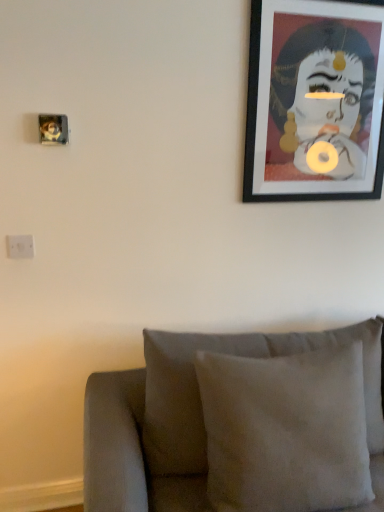
The width and height of the screenshot is (384, 512). In order to click on suede cushion at lower center in this screenshot , I will do `click(239, 424)`.

I want to click on black matte picture frame at upper right, so click(315, 101).

Is white plastic electric outlet at left positioned behind suede cushion at lower center?

Yes, white plastic electric outlet at left is further from the camera.

Considering the relative sizes of white plastic electric outlet at left and suede cushion at lower center in the image provided, is white plastic electric outlet at left smaller than suede cushion at lower center?

Yes, white plastic electric outlet at left is smaller than suede cushion at lower center.

Measure the distance from white plastic electric outlet at left to suede cushion at lower center.

A distance of 37.07 inches exists between white plastic electric outlet at left and suede cushion at lower center.

Is the surface of white plastic electric outlet at left in direct contact with suede cushion at lower center?

There is a gap between white plastic electric outlet at left and suede cushion at lower center.

Between point (247, 484) and point (373, 60), which one is positioned in front?

Point (247, 484)

In the scene shown: Considering the relative positions of suede cushion at lower center and black matte picture frame at upper right in the image provided, is suede cushion at lower center to the left or to the right of black matte picture frame at upper right?

Clearly, suede cushion at lower center is on the left of black matte picture frame at upper right in the image.

Does suede cushion at lower center have a greater height compared to black matte picture frame at upper right?

Yes, suede cushion at lower center is taller than black matte picture frame at upper right.

Would you consider black matte picture frame at upper right to be distant from suede cushion at lower center?

No, black matte picture frame at upper right is in close proximity to suede cushion at lower center.

Looking at their sizes, would you say black matte picture frame at upper right is wider or thinner than suede cushion at lower center?

Clearly, black matte picture frame at upper right has less width compared to suede cushion at lower center.

Considering the positions of points (351, 136) and (333, 348), is point (351, 136) farther from camera compared to point (333, 348)?

Yes, point (351, 136) is behind point (333, 348).

From a real-world perspective, is black matte picture frame at upper right over suede cushion at lower center?

Yes, from a real-world perspective, black matte picture frame at upper right is on top of suede cushion at lower center.

From the image's perspective, which is above, black matte picture frame at upper right or white plastic electric outlet at left?

black matte picture frame at upper right appears higher in the image.

From the picture: From a real-world perspective, is black matte picture frame at upper right positioned over white plastic electric outlet at left based on gravity?

Yes, from a real-world perspective, black matte picture frame at upper right is over white plastic electric outlet at left

Are black matte picture frame at upper right and white plastic electric outlet at left making contact?

black matte picture frame at upper right and white plastic electric outlet at left are clearly separated.

Considering their positions, is black matte picture frame at upper right located in front of or behind white plastic electric outlet at left?

black matte picture frame at upper right is in front of white plastic electric outlet at left.

Locate an element on the screen. This screenshot has width=384, height=512. furniture that appears below the white plastic electric outlet at left (from a real-world perspective) is located at coordinates (239, 424).

Which point is more forward, (x=89, y=437) or (x=29, y=243)?

The point (x=89, y=437) is closer.

Which object is positioned more to the right, suede cushion at lower center or white plastic electric outlet at left?

suede cushion at lower center is more to the right.

Is suede cushion at lower center oriented away from white plastic electric outlet at left?

suede cushion at lower center does not have its back to white plastic electric outlet at left.

From the image's perspective, does white plastic electric outlet at left appear higher than black matte picture frame at upper right?

No, from the image's perspective, white plastic electric outlet at left is not over black matte picture frame at upper right.

Is white plastic electric outlet at left looking in the opposite direction of black matte picture frame at upper right?

No, white plastic electric outlet at left's orientation is not away from black matte picture frame at upper right.

Considering the sizes of objects white plastic electric outlet at left and black matte picture frame at upper right in the image provided, who is smaller, white plastic electric outlet at left or black matte picture frame at upper right?

Smaller between the two is white plastic electric outlet at left.

Where is `furniture to the right of white plastic electric outlet at left`? This screenshot has height=512, width=384. furniture to the right of white plastic electric outlet at left is located at coordinates pos(239,424).

Image resolution: width=384 pixels, height=512 pixels. I want to click on picture frame that is behind the suede cushion at lower center, so click(315, 101).

From the picture: From the image, which object appears to be farther from white plastic electric outlet at left, suede cushion at lower center or black matte picture frame at upper right?

Based on the image, black matte picture frame at upper right appears to be further to white plastic electric outlet at left.

From the picture: Estimate the real-world distances between objects in this image. Which object is closer to black matte picture frame at upper right, suede cushion at lower center or white plastic electric outlet at left?

suede cushion at lower center lies closer to black matte picture frame at upper right than the other object.

Which object lies nearer to the anchor point white plastic electric outlet at left, black matte picture frame at upper right or suede cushion at lower center?

suede cushion at lower center.

Which object lies further to the anchor point suede cushion at lower center, white plastic electric outlet at left or black matte picture frame at upper right?

The object further to suede cushion at lower center is white plastic electric outlet at left.

Based on the photo, estimate the real-world distances between objects in this image. Which object is closer to suede cushion at lower center, black matte picture frame at upper right or white plastic electric outlet at left?

black matte picture frame at upper right is closer to suede cushion at lower center.

When comparing their distances from black matte picture frame at upper right, does white plastic electric outlet at left or suede cushion at lower center seem closer?

suede cushion at lower center lies closer to black matte picture frame at upper right than the other object.

What are the coordinates of `electric outlet between black matte picture frame at upper right and suede cushion at lower center in the up-down direction` in the screenshot? It's located at (20, 246).